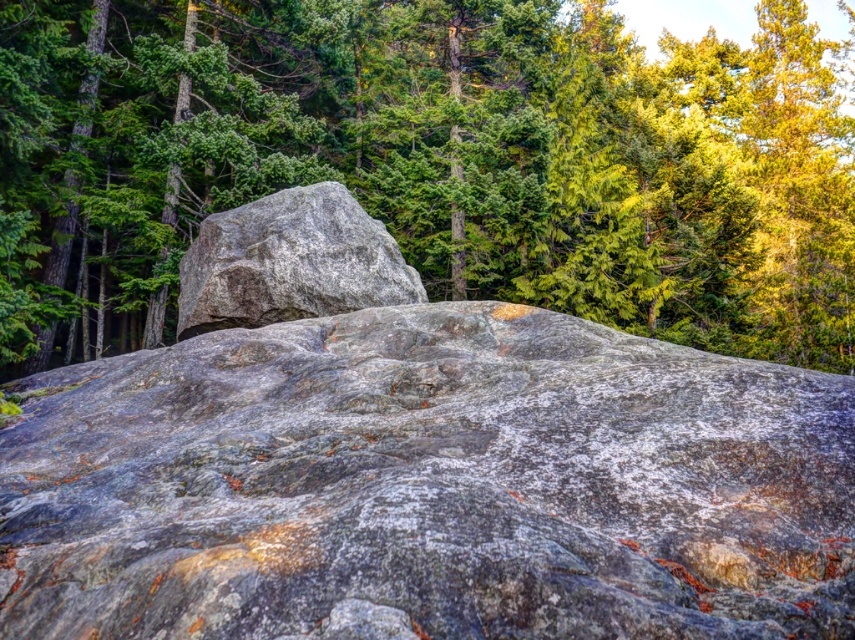
Question: Which of the following is the closest to the observer?

Choices:
 (A) green textured tree at upper center
 (B) gray rough boulder at center

Answer: (A)

Question: Based on their relative distances, which object is farther from the gray granite rock at center?

Choices:
 (A) gray rough boulder at center
 (B) green textured tree at upper center

Answer: (B)

Question: Which point is farther to the camera?

Choices:
 (A) (581, 184)
 (B) (541, 353)

Answer: (A)

Question: From the image, what is the correct spatial relationship of green textured tree at upper center in relation to gray rough boulder at center?

Choices:
 (A) below
 (B) above

Answer: (B)

Question: Can you confirm if gray granite rock at center is bigger than green textured tree at upper center?

Choices:
 (A) yes
 (B) no

Answer: (B)

Question: Can you confirm if gray granite rock at center is bigger than green textured tree at upper center?

Choices:
 (A) yes
 (B) no

Answer: (B)